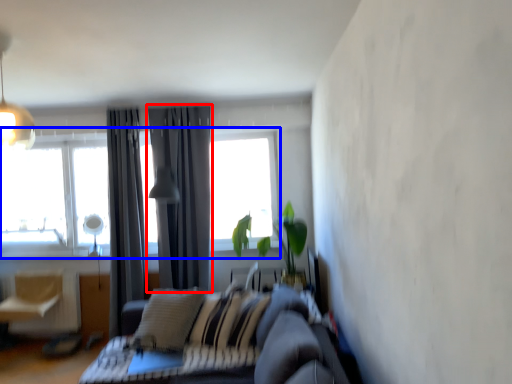
Question: Which object is closer to the camera taking this photo, curtain (highlighted by a red box) or window (highlighted by a blue box)?

Choices:
 (A) curtain
 (B) window

Answer: (A)